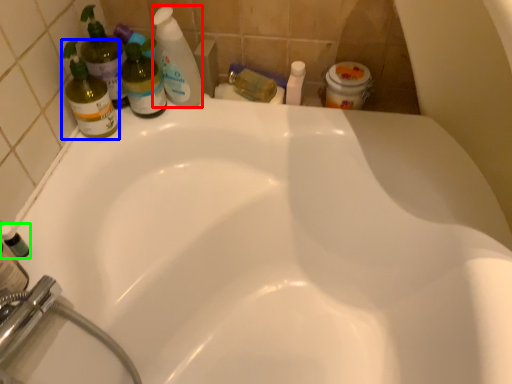
Question: Estimate the real-world distances between objects in this image. Which object is farther from cleaning product (highlighted by a red box), cleaning product (highlighted by a blue box) or mouthwash (highlighted by a green box)?

Choices:
 (A) cleaning product
 (B) mouthwash

Answer: (B)